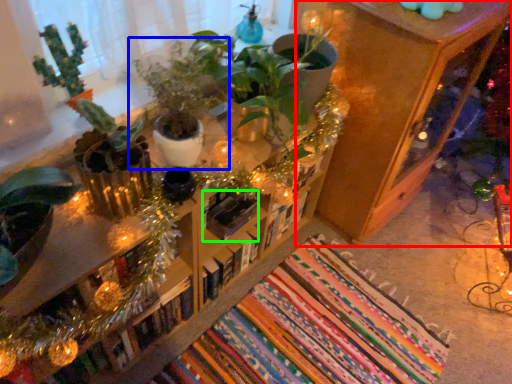
Question: Which object is positioned closest to shelf (highlighted by a red box)? Select from houseplant (highlighted by a blue box) and book (highlighted by a green box).

Choices:
 (A) houseplant
 (B) book

Answer: (B)